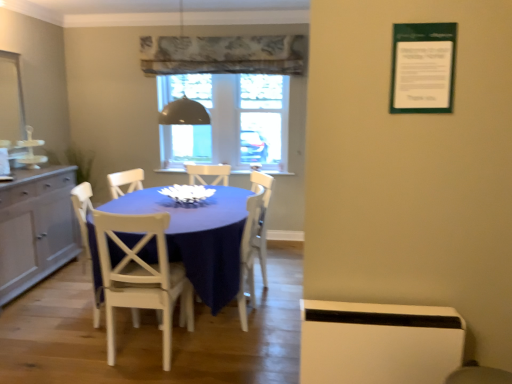
Question: Is white wood chair at center, the 2th chair in the front-to-back sequence, to the left of white painted wood chair at center, marked as the first chair in a front-to-back arrangement, from the viewer's perspective?

Choices:
 (A) yes
 (B) no

Answer: (A)

Question: Can you confirm if white wood chair at center, acting as the second chair starting from the back, is shorter than white painted wood chair at center, marked as the first chair in a front-to-back arrangement?

Choices:
 (A) no
 (B) yes

Answer: (A)

Question: Is white wood chair at center, the 3th chair when ordered from right to left, located outside white painted wood chair at center, the second chair from the right?

Choices:
 (A) yes
 (B) no

Answer: (A)

Question: Is white wood chair at center, the 2th chair in the front-to-back sequence, facing away from white painted wood chair at center, placed as the second chair when sorted from left to right?

Choices:
 (A) yes
 (B) no

Answer: (B)

Question: Is white wood chair at center, which is the first chair from left to right, taller than white painted wood chair at center, marked as the first chair in a front-to-back arrangement?

Choices:
 (A) yes
 (B) no

Answer: (A)

Question: Does white wood chair at center, which is the first chair from left to right, appear on the right side of white painted wood chair at center, which ranks as the third chair in back-to-front order?

Choices:
 (A) yes
 (B) no

Answer: (B)

Question: Does white painted wood chair at center, the second chair from the right, have a lesser height compared to metallic dome at upper center?

Choices:
 (A) yes
 (B) no

Answer: (B)

Question: Does white painted wood chair at center, placed as the second chair when sorted from left to right, appear on the right side of metallic dome at upper center?

Choices:
 (A) yes
 (B) no

Answer: (B)

Question: From a real-world perspective, is white painted wood chair at center, which ranks as the third chair in back-to-front order, located higher than metallic dome at upper center?

Choices:
 (A) yes
 (B) no

Answer: (B)

Question: Is the position of white painted wood chair at center, placed as the second chair when sorted from left to right, more distant than that of metallic dome at upper center?

Choices:
 (A) no
 (B) yes

Answer: (A)

Question: Can you confirm if white painted wood chair at center, which ranks as the third chair in back-to-front order, is thinner than metallic dome at upper center?

Choices:
 (A) no
 (B) yes

Answer: (A)

Question: Considering the relative sizes of white painted wood chair at center, which ranks as the third chair in back-to-front order, and metallic dome at upper center in the image provided, is white painted wood chair at center, which ranks as the third chair in back-to-front order, smaller than metallic dome at upper center?

Choices:
 (A) yes
 (B) no

Answer: (B)

Question: From a real-world perspective, is white wood chair at center, which ranks as the first chair in back-to-front order, under metallic dome at upper center?

Choices:
 (A) yes
 (B) no

Answer: (A)